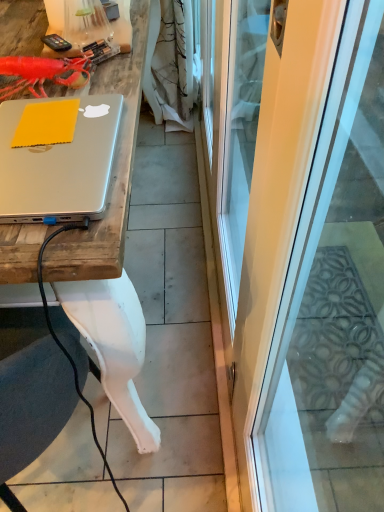
Question: In terms of height, does matte silver laptop at upper left look taller or shorter compared to rubberized plastic lobster at upper left?

Choices:
 (A) tall
 (B) short

Answer: (B)

Question: Is matte silver laptop at upper left in front of or behind rubberized plastic lobster at upper left in the image?

Choices:
 (A) front
 (B) behind

Answer: (A)

Question: Estimate the real-world distances between objects in this image. Which object is closer to the matte silver laptop at upper left?

Choices:
 (A) transparent glass screen door at center
 (B) silver metallic desk at upper left
 (C) rubberized plastic lobster at upper left

Answer: (B)

Question: Considering the real-world distances, which object is farthest from the matte silver laptop at upper left?

Choices:
 (A) rubberized plastic lobster at upper left
 (B) silver metallic desk at upper left
 (C) transparent glass screen door at center

Answer: (C)